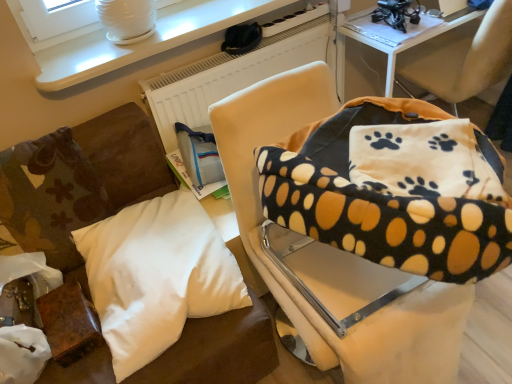
Question: From a real-world perspective, is white soft pillow at lower left, the 1th pillow when ordered from left to right, physically below white matte radiator at upper center?

Choices:
 (A) yes
 (B) no

Answer: (B)

Question: Would you say white soft pillow at lower left, the third pillow positioned from the right, is outside white matte radiator at upper center?

Choices:
 (A) yes
 (B) no

Answer: (A)

Question: Is white soft pillow at lower left, the third pillow positioned from the right, further to the viewer compared to white matte radiator at upper center?

Choices:
 (A) yes
 (B) no

Answer: (B)

Question: Is white soft pillow at lower left, the 1th pillow when ordered from left to right, thinner than white matte radiator at upper center?

Choices:
 (A) yes
 (B) no

Answer: (B)

Question: Is white soft pillow at lower left, the third pillow positioned from the right, shorter than white matte radiator at upper center?

Choices:
 (A) yes
 (B) no

Answer: (A)

Question: Is white glossy table at upper left to the left or to the right of soft beige chair at center, acting as the 1th chair starting from the left, in the image?

Choices:
 (A) right
 (B) left

Answer: (B)

Question: Considering the positions of white glossy table at upper left and soft beige chair at center, acting as the 1th chair starting from the left, in the image, is white glossy table at upper left taller or shorter than soft beige chair at center, acting as the 1th chair starting from the left,?

Choices:
 (A) tall
 (B) short

Answer: (B)

Question: Is white glossy table at upper left inside the boundaries of soft beige chair at center, acting as the 1th chair starting from the left, or outside?

Choices:
 (A) inside
 (B) outside

Answer: (B)

Question: In terms of width, does white glossy table at upper left look wider or thinner when compared to soft beige chair at center, acting as the 1th chair starting from the left?

Choices:
 (A) thin
 (B) wide

Answer: (A)

Question: Considering their positions, is soft fleece blanket at upper right, which appears as the 1th chair when viewed from the right, located in front of or behind white soft pillow at lower left, the second pillow in the left-to-right sequence?

Choices:
 (A) front
 (B) behind

Answer: (B)

Question: Looking at the image, does soft fleece blanket at upper right, which appears as the 1th chair when viewed from the right, seem bigger or smaller compared to white soft pillow at lower left, acting as the 2th pillow starting from the right?

Choices:
 (A) small
 (B) big

Answer: (B)

Question: Is soft fleece blanket at upper right, which is the second chair from left to right, wider or thinner than white soft pillow at lower left, the second pillow in the left-to-right sequence?

Choices:
 (A) thin
 (B) wide

Answer: (B)

Question: Based on their positions, is soft fleece blanket at upper right, which appears as the 1th chair when viewed from the right, located to the left or right of white soft pillow at lower left, the second pillow in the left-to-right sequence?

Choices:
 (A) right
 (B) left

Answer: (A)

Question: Relative to white matte radiator at upper center, is white soft pillow at lower left, the 1th pillow when ordered from left to right, in front or behind?

Choices:
 (A) behind
 (B) front

Answer: (B)

Question: Would you say white soft pillow at lower left, the 1th pillow when ordered from left to right, is to the left or to the right of white matte radiator at upper center in the picture?

Choices:
 (A) right
 (B) left

Answer: (B)